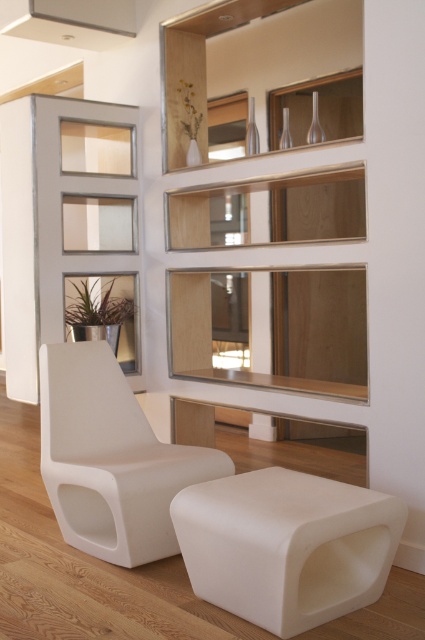
Question: Observing the image, what is the correct spatial positioning of white matte/styrene stool at center in reference to white matte armchair at center?

Choices:
 (A) right
 (B) left

Answer: (A)

Question: Does white matte/styrene stool at center appear on the left side of white matte armchair at center?

Choices:
 (A) no
 (B) yes

Answer: (A)

Question: Is white matte/styrene stool at center above white matte armchair at center?

Choices:
 (A) yes
 (B) no

Answer: (B)